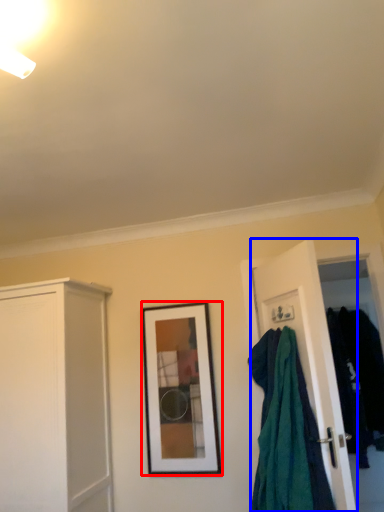
Question: Which of the following is the closest to the observer, picture frame (highlighted by a red box) or door (highlighted by a blue box)?

Choices:
 (A) picture frame
 (B) door

Answer: (B)